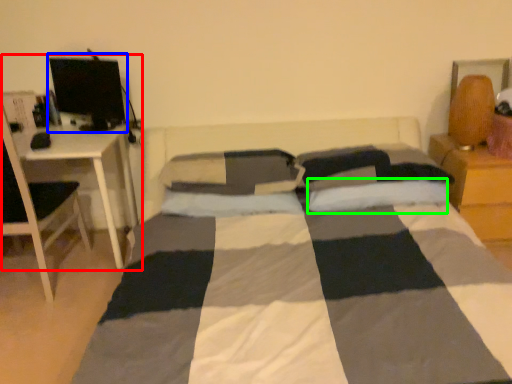
Question: Which is farther away from computer desk (highlighted by a red box)? computer monitor (highlighted by a blue box) or pillow (highlighted by a green box)?

Choices:
 (A) computer monitor
 (B) pillow

Answer: (B)